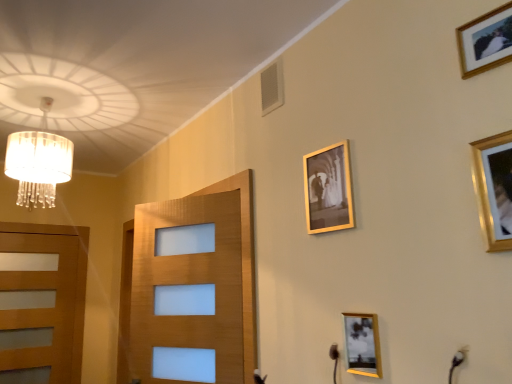
Locate an element on the screen. Image resolution: width=512 pixels, height=384 pixels. translucent glass chandelier at upper left is located at coordinates (38, 162).

Find the location of a particular element. The image size is (512, 384). gold metallic picture frame at upper center, which ranks as the 1th picture frame in back-to-front order is located at coordinates (328, 189).

Describe the element at coordinates (362, 344) in the screenshot. I see `gold-framed photo at lower right, the first picture frame from the bottom` at that location.

What do you see at coordinates (494, 188) in the screenshot? This screenshot has height=384, width=512. I see `gold metallic picture frame at upper right, acting as the 3th picture frame starting from the bottom` at bounding box center [494, 188].

Find the location of a particular element. This screenshot has width=512, height=384. gold-framed photo at upper right, arranged as the 2th picture frame when viewed from the front is located at coordinates (485, 41).

Is gold metallic picture frame at upper right, the first picture frame viewed from the right, bigger than gold-framed photo at upper right, arranged as the third picture frame when viewed from the left?

Indeed, gold metallic picture frame at upper right, the first picture frame viewed from the right, has a larger size compared to gold-framed photo at upper right, arranged as the third picture frame when viewed from the left.

Does gold metallic picture frame at upper right, placed as the 4th picture frame when sorted from left to right, turn towards gold-framed photo at upper right, the 1th picture frame positioned from the top?

No, gold metallic picture frame at upper right, placed as the 4th picture frame when sorted from left to right, is not turned towards gold-framed photo at upper right, the 1th picture frame positioned from the top.

Do you think gold metallic picture frame at upper right, the 4th picture frame positioned from the back, is within gold-framed photo at upper right, arranged as the 2th picture frame when viewed from the front, or outside of it?

gold metallic picture frame at upper right, the 4th picture frame positioned from the back, is spatially situated outside gold-framed photo at upper right, arranged as the 2th picture frame when viewed from the front.

From a real-world perspective, is gold metallic picture frame at upper center, which is the second picture frame in bottom-to-top order, positioned over translucent glass chandelier at upper left based on gravity?

Incorrect, from a real-world perspective, gold metallic picture frame at upper center, which is the second picture frame in bottom-to-top order, is lower than translucent glass chandelier at upper left.

Is gold metallic picture frame at upper center, which appears as the fourth picture frame when viewed from the front, located outside translucent glass chandelier at upper left?

Absolutely, gold metallic picture frame at upper center, which appears as the fourth picture frame when viewed from the front, is external to translucent glass chandelier at upper left.

Can you confirm if gold metallic picture frame at upper center, acting as the 1th picture frame starting from the left, is wider than translucent glass chandelier at upper left?

Incorrect, the width of gold metallic picture frame at upper center, acting as the 1th picture frame starting from the left, does not surpass that of translucent glass chandelier at upper left.

Considering the relative sizes of gold metallic picture frame at upper center, the 3th picture frame when ordered from top to bottom, and translucent glass chandelier at upper left in the image provided, is gold metallic picture frame at upper center, the 3th picture frame when ordered from top to bottom, bigger than translucent glass chandelier at upper left?

Incorrect, gold metallic picture frame at upper center, the 3th picture frame when ordered from top to bottom, is not larger than translucent glass chandelier at upper left.

Could you tell me if gold-framed photo at upper right, the third picture frame in the back-to-front sequence, is turned towards gold-framed photo at lower right, the fourth picture frame in the top-to-bottom sequence?

No, gold-framed photo at upper right, the third picture frame in the back-to-front sequence, is not facing towards gold-framed photo at lower right, the fourth picture frame in the top-to-bottom sequence.

Is gold-framed photo at upper right, the third picture frame in the back-to-front sequence, positioned behind gold-framed photo at lower right, acting as the 3th picture frame starting from the right?

No, gold-framed photo at upper right, the third picture frame in the back-to-front sequence, is closer to the camera.

From the image's perspective, between gold-framed photo at upper right, arranged as the 2th picture frame when viewed from the front, and gold-framed photo at lower right, the second picture frame when ordered from left to right, which one is located above?

gold-framed photo at upper right, arranged as the 2th picture frame when viewed from the front, is shown above in the image.

Which object is further away from the camera, gold metallic picture frame at upper right, which is the 2th picture frame in top-to-bottom order, or wooden door at left?

wooden door at left is further away from the camera.

Which of these two, gold metallic picture frame at upper right, which is the 2th picture frame in top-to-bottom order, or wooden door at left, stands taller?

Standing taller between the two is wooden door at left.

Is gold metallic picture frame at upper right, placed as the 4th picture frame when sorted from left to right, facing towards wooden door at left?

No.

Considering the relative sizes of gold metallic picture frame at upper right, arranged as the first picture frame when viewed from the front, and translucent glass chandelier at upper left in the image provided, is gold metallic picture frame at upper right, arranged as the first picture frame when viewed from the front, taller than translucent glass chandelier at upper left?

Incorrect, the height of gold metallic picture frame at upper right, arranged as the first picture frame when viewed from the front, is not larger of that of translucent glass chandelier at upper left.

Consider the image. Which is more to the left, gold metallic picture frame at upper right, placed as the 4th picture frame when sorted from left to right, or translucent glass chandelier at upper left?

translucent glass chandelier at upper left is more to the left.

Does gold metallic picture frame at upper right, acting as the 3th picture frame starting from the bottom, come behind translucent glass chandelier at upper left?

No, gold metallic picture frame at upper right, acting as the 3th picture frame starting from the bottom, is closer to the camera.

Does wooden door at left have a greater height compared to translucent glass chandelier at upper left?

Yes.

Can you confirm if wooden door at left is positioned to the left of translucent glass chandelier at upper left?

Yes, wooden door at left is to the left of translucent glass chandelier at upper left.

From a real-world perspective, which object rests below the other?

In real-world perspective, wooden door at left is lower.

In the scene shown: From the image's perspective, is gold-framed photo at lower right, the second picture frame when ordered from left to right, over gold-framed photo at upper right, marked as the 4th picture frame in a bottom-to-top arrangement?

No, from the image's perspective, gold-framed photo at lower right, the second picture frame when ordered from left to right, is not on top of gold-framed photo at upper right, marked as the 4th picture frame in a bottom-to-top arrangement.

Is gold-framed photo at lower right, which is counted as the 3th picture frame, starting from the front, placed right next to gold-framed photo at upper right, arranged as the third picture frame when viewed from the left?

No, gold-framed photo at lower right, which is counted as the 3th picture frame, starting from the front, is not with gold-framed photo at upper right, arranged as the third picture frame when viewed from the left.

This screenshot has width=512, height=384. I want to click on the 1st picture frame behind the gold-framed photo at upper right, the 1th picture frame positioned from the top, counting from the anchor's position, so click(x=362, y=344).

Find the location of a particular element. The height and width of the screenshot is (384, 512). picture frame above the gold metallic picture frame at upper right, the first picture frame viewed from the right (from the image's perspective) is located at coordinates (485, 41).

At what (x,y) coordinates should I click in order to perform the action: click on the 2nd picture frame below the translucent glass chandelier at upper left (from the image's perspective). Please return your answer as a coordinate pair (x, y). The width and height of the screenshot is (512, 384). Looking at the image, I should click on (328, 189).

Looking at the image, which one is located closer to gold-framed photo at lower right, the first picture frame from the bottom, gold metallic picture frame at upper right, acting as the 3th picture frame starting from the bottom, or gold-framed photo at upper right, which is counted as the second picture frame, starting from the right?

gold metallic picture frame at upper right, acting as the 3th picture frame starting from the bottom, is positioned closer to the anchor gold-framed photo at lower right, the first picture frame from the bottom.

Estimate the real-world distances between objects in this image. Which object is closer to gold-framed photo at lower right, the second picture frame when ordered from left to right, gold metallic picture frame at upper center, which is counted as the 4th picture frame, starting from the right, or translucent glass chandelier at upper left?

gold metallic picture frame at upper center, which is counted as the 4th picture frame, starting from the right, lies closer to gold-framed photo at lower right, the second picture frame when ordered from left to right, than the other object.

When comparing their distances from gold-framed photo at upper right, the 1th picture frame positioned from the top, does translucent glass chandelier at upper left or gold-framed photo at lower right, acting as the 3th picture frame starting from the right, seem closer?

gold-framed photo at lower right, acting as the 3th picture frame starting from the right, is positioned closer to the anchor gold-framed photo at upper right, the 1th picture frame positioned from the top.

Estimate the real-world distances between objects in this image. Which object is closer to gold-framed photo at lower right, the second picture frame viewed from the back, wooden door at left or translucent glass chandelier at upper left?

translucent glass chandelier at upper left is positioned closer to the anchor gold-framed photo at lower right, the second picture frame viewed from the back.

From the image, which object appears to be nearer to translucent glass chandelier at upper left, gold-framed photo at lower right, acting as the 3th picture frame starting from the right, or gold metallic picture frame at upper center, acting as the 1th picture frame starting from the left?

gold metallic picture frame at upper center, acting as the 1th picture frame starting from the left, is positioned closer to the anchor translucent glass chandelier at upper left.

From the image, which object appears to be farther from gold metallic picture frame at upper center, acting as the 1th picture frame starting from the left, translucent glass chandelier at upper left or gold-framed photo at upper right, arranged as the 2th picture frame when viewed from the front?

translucent glass chandelier at upper left is positioned further to the anchor gold metallic picture frame at upper center, acting as the 1th picture frame starting from the left.

Consider the image. From the image, which object appears to be farther from gold-framed photo at lower right, acting as the 3th picture frame starting from the right, gold-framed photo at upper right, marked as the 4th picture frame in a bottom-to-top arrangement, or translucent glass chandelier at upper left?

translucent glass chandelier at upper left.

Considering their positions, is gold metallic picture frame at upper right, acting as the 3th picture frame starting from the bottom, positioned further to gold-framed photo at lower right, which is counted as the 3th picture frame, starting from the front, than wooden door at left?

Based on the image, wooden door at left appears to be further to gold-framed photo at lower right, which is counted as the 3th picture frame, starting from the front.

Where is `picture frame between translucent glass chandelier at upper left and gold-framed photo at lower right, the second picture frame viewed from the back, in the horizontal direction`? Image resolution: width=512 pixels, height=384 pixels. picture frame between translucent glass chandelier at upper left and gold-framed photo at lower right, the second picture frame viewed from the back, in the horizontal direction is located at coordinates (328, 189).

Find the location of a particular element. The height and width of the screenshot is (384, 512). picture frame between wooden door at left and gold-framed photo at lower right, the fourth picture frame in the top-to-bottom sequence, in the horizontal direction is located at coordinates (328, 189).

Where is `lamp located between wooden door at left and gold-framed photo at lower right, the first picture frame from the bottom, in the left-right direction`? The height and width of the screenshot is (384, 512). lamp located between wooden door at left and gold-framed photo at lower right, the first picture frame from the bottom, in the left-right direction is located at coordinates (38, 162).

I want to click on lamp located between wooden door at left and gold metallic picture frame at upper center, which is the second picture frame in bottom-to-top order, in the left-right direction, so click(38, 162).